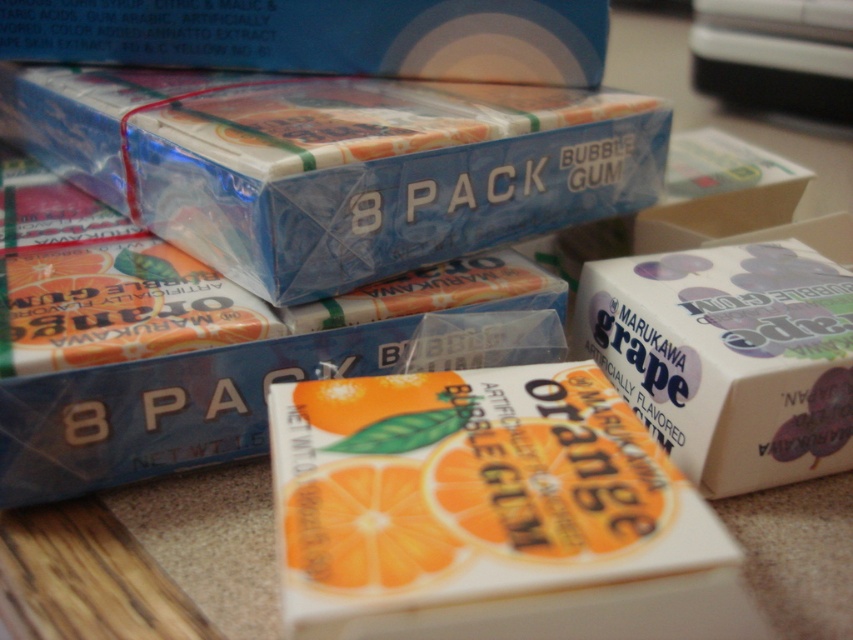
Can you confirm if matte plastic bubble gum at upper center is taller than orange matte bubble gum at center?

Correct, matte plastic bubble gum at upper center is much taller as orange matte bubble gum at center.

Is point (578, 83) more distant than point (403, 540)?

Yes, point (578, 83) is farther from viewer.

Is point (297, 19) farther from viewer compared to point (431, 564)?

Yes, point (297, 19) is farther from viewer.

I want to click on matte plastic bubble gum at upper center, so click(321, 36).

Is blue glossy bubble gum pack at center further to camera compared to matte plastic bubble gum at upper center?

No, blue glossy bubble gum pack at center is closer to the viewer.

This screenshot has height=640, width=853. What do you see at coordinates (334, 164) in the screenshot?
I see `blue glossy bubble gum pack at center` at bounding box center [334, 164].

Locate an element on the screen. This screenshot has height=640, width=853. blue glossy bubble gum pack at center is located at coordinates (334, 164).

Between blue glossy bubble gum pack at center and white matte grape bubble gum at center, which one has less height?

white matte grape bubble gum at center is shorter.

Can you confirm if blue glossy bubble gum pack at center is shorter than white matte grape bubble gum at center?

Incorrect, blue glossy bubble gum pack at center's height does not fall short of white matte grape bubble gum at center's.

Is point (93, 83) closer to viewer compared to point (787, 250)?

That is False.

The width and height of the screenshot is (853, 640). I want to click on blue glossy bubble gum pack at center, so click(334, 164).